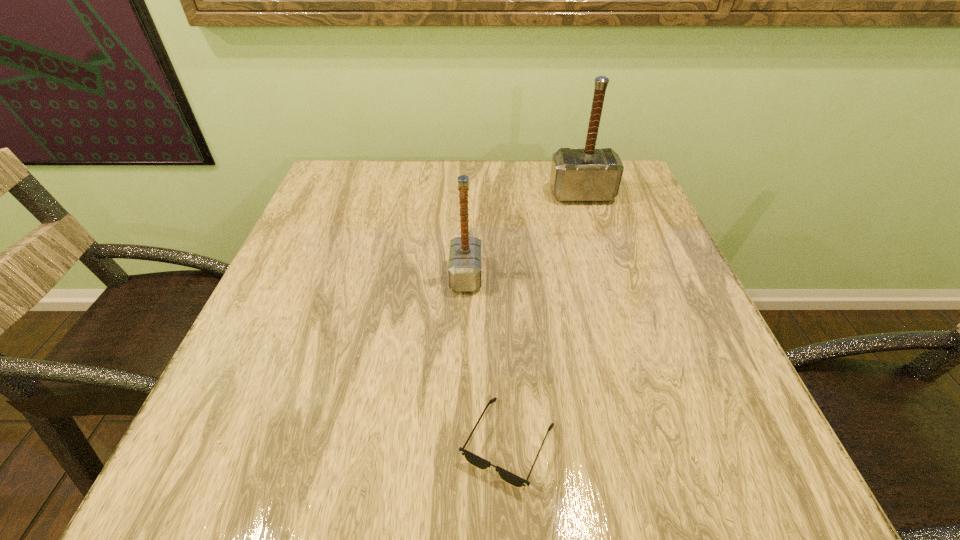
The image size is (960, 540). Identify the location of object that is at the right edge. (577, 175).

Identify the location of object that is at the far right corner. (577, 175).

Find the location of a particular element. vacant point at the far edge is located at coordinates (414, 182).

In the image, there is a desktop. Where is `vacant space at the near edge`? vacant space at the near edge is located at coordinates pos(330,479).

In the image, there is a desktop. Find the location of `vacant space at the left edge`. vacant space at the left edge is located at coordinates (277, 303).

In the image, there is a desktop. Identify the location of vacant space at the right edge. This screenshot has width=960, height=540. (705, 355).

Locate an element on the screen. blank area at the far left corner is located at coordinates (355, 168).

Locate an element on the screen. The height and width of the screenshot is (540, 960). free space between the shortest object and the taller hammer is located at coordinates (545, 319).

Where is `empty space that is in between the rightmost object and the shortest object`? empty space that is in between the rightmost object and the shortest object is located at coordinates (545, 319).

Identify the location of vacant space that is in between the shortest object and the right hammer. (545, 319).